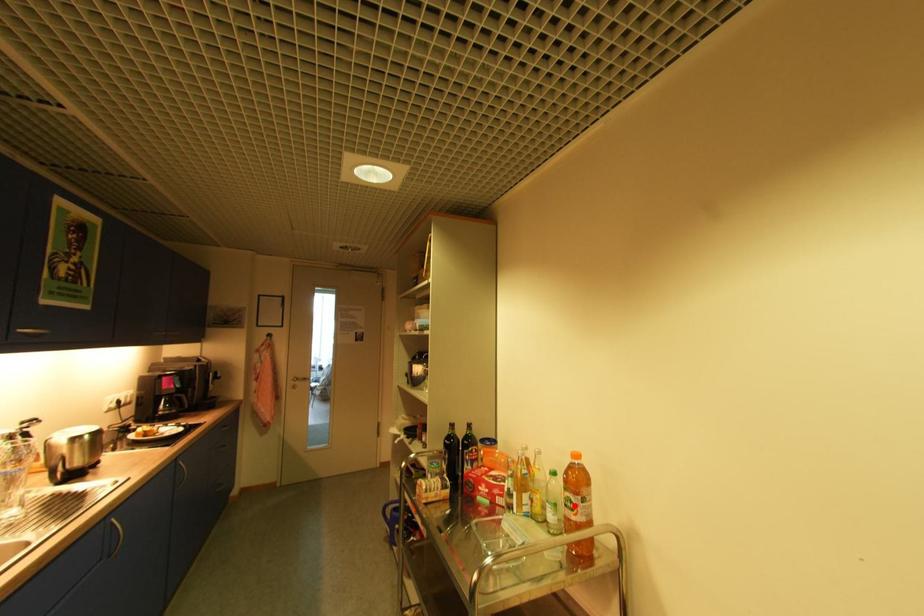
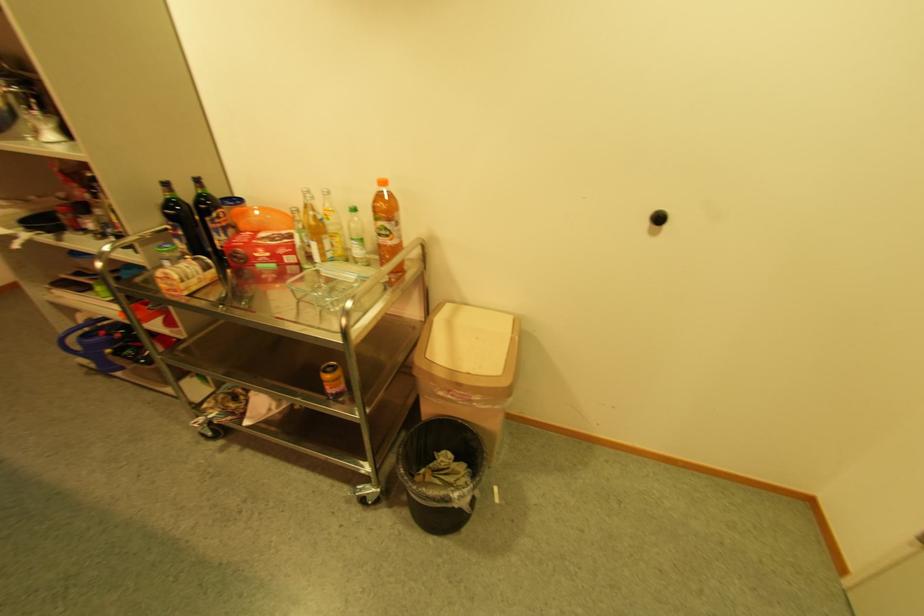
Question: I am providing you with two images of the same scene from different viewpoints. Image1 has a red point marked. In image2, the corresponding 3D location appears at what relative position? Reply with the corresponding letter.

Choices:
 (A) Closer
 (B) Farther

Answer: (A)